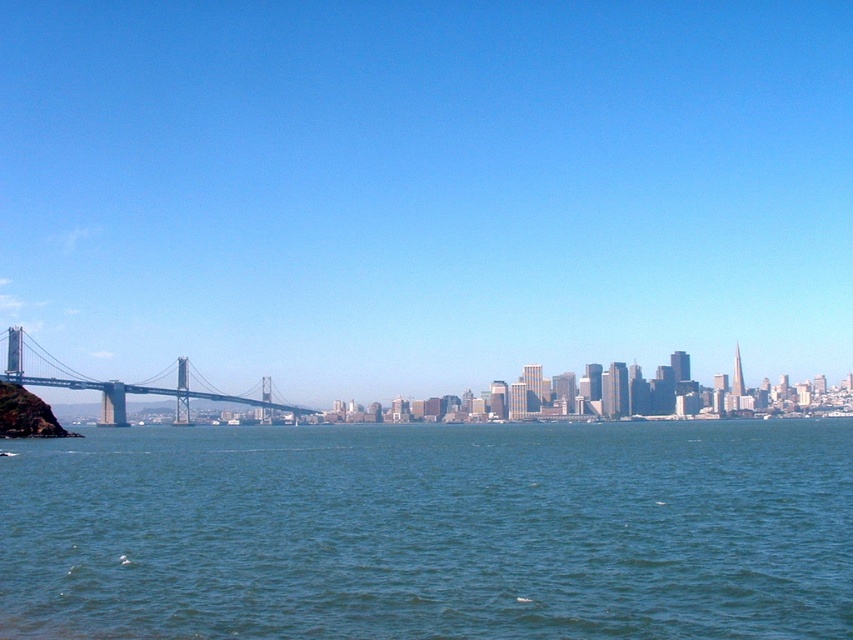
You are a city planner evaluating the structural integrity of the bridges in the image. Considering the height of the transparent glass bridge at center and the metallic gray bridge at left, which bridge would require a taller support structure for its cables?

The transparent glass bridge at center requires a taller support structure because it is taller than the metallic gray bridge at left, necessitating higher towers to anchor its cables effectively.

You are a tourist standing on the shore of the bay and want to take a photo that includes both the green water at lower center and the metallic gray bridge at left. Based on their positions, where should you position yourself to ensure both are visible in your frame?

Since the green water at lower center is located below the metallic gray bridge at left, you should position yourself so that the camera is angled downward to capture the green water at lower center while still framing the metallic gray bridge at left above it.